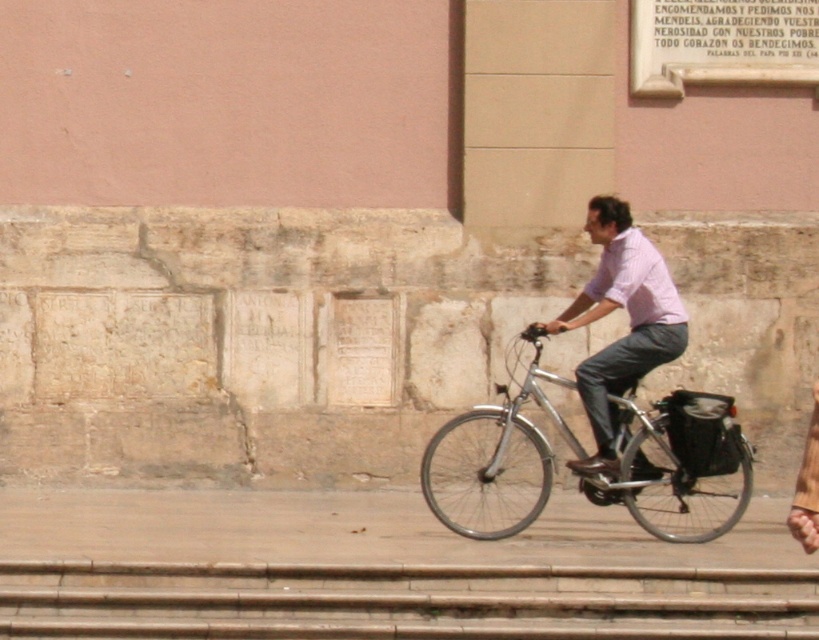
Question: From the image, what is the correct spatial relationship of silver metallic bicycle at center in relation to pink cotton shirt at center?

Choices:
 (A) below
 (B) above

Answer: (A)

Question: Among these objects, which one is nearest to the camera?

Choices:
 (A) pink cotton shirt at center
 (B) silver metallic bicycle at center

Answer: (B)

Question: Is silver metallic bicycle at center wider than pink cotton shirt at center?

Choices:
 (A) yes
 (B) no

Answer: (A)

Question: Which object is farther from the camera taking this photo?

Choices:
 (A) silver metallic bicycle at center
 (B) pink cotton shirt at center

Answer: (B)

Question: Can you confirm if silver metallic bicycle at center is smaller than pink cotton shirt at center?

Choices:
 (A) no
 (B) yes

Answer: (A)